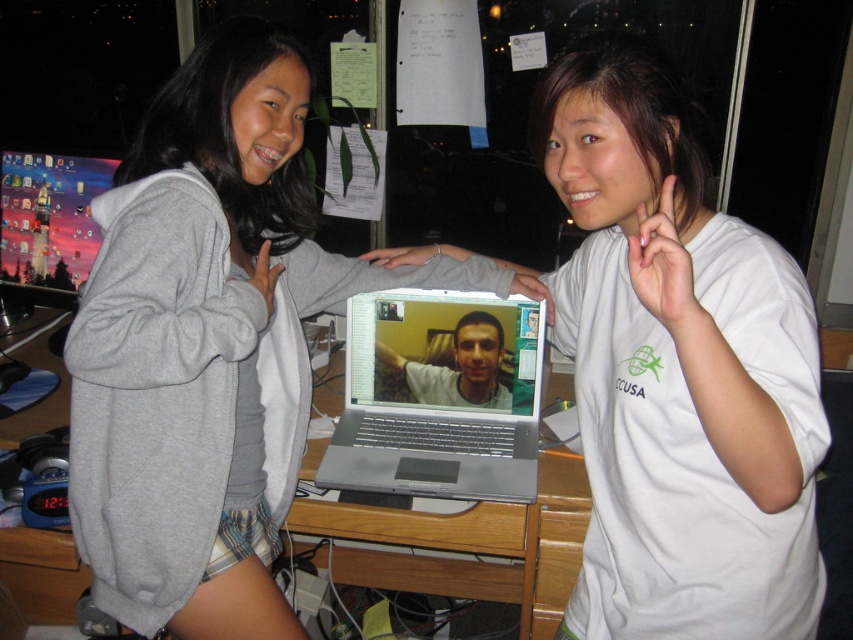
You are taking a photo of the two points marked in the image. Which point, point (223, 346) or point (48, 166), will appear larger in your photo?

Point (223, 346) is closer to the camera than point (48, 166), so it will appear larger in the photo.

Based on the photo, you are trying to place a new keyboard that is 15 inches wide on the desk between the white cotton shirt at center and the matte plastic monitor at left. Based on their widths, will the keyboard fit between them?

The white cotton shirt at center might be wider than matte plastic monitor at left, so the keyboard might not fit between them if the shirt is wider than the monitor. The exact width difference is unknown, so it is uncertain.

You are a photographer trying to capture a candid shot of the two people in the scene. You want to focus on the point at coordinate point (677, 371). Where is this point located in relation to the two people?

The point at coordinate (677, 371) is located on the white cotton shirt at center.